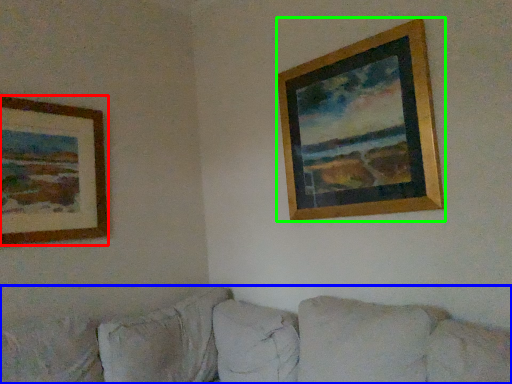
Question: Which object is the closest to the picture frame (highlighted by a red box)? Choose among these: studio couch (highlighted by a blue box) or picture frame (highlighted by a green box).

Choices:
 (A) studio couch
 (B) picture frame

Answer: (A)